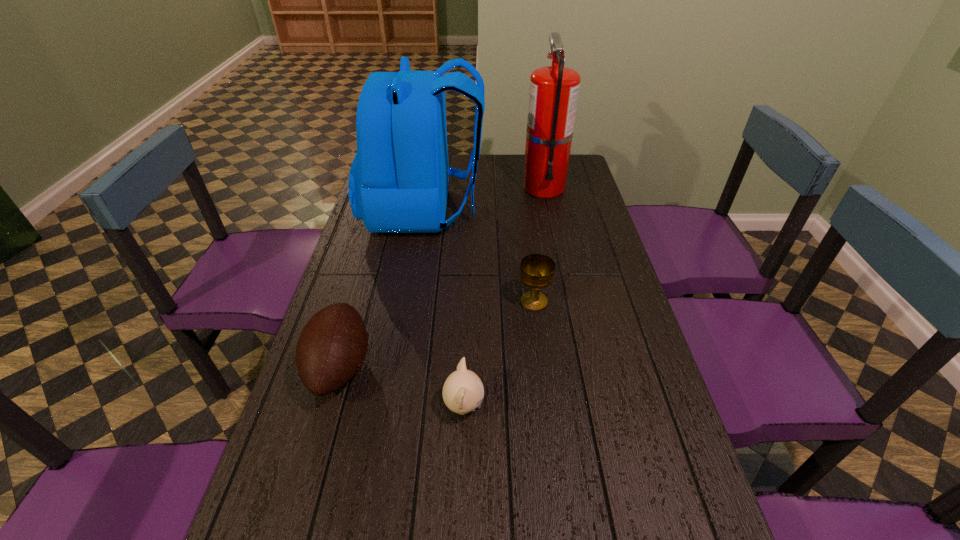
Identify the location of fire extinguisher that is at the far edge. (553, 96).

This screenshot has width=960, height=540. Find the location of `backpack that is at the far edge`. backpack that is at the far edge is located at coordinates (398, 182).

Identify the location of backpack that is at the left edge. (398, 182).

I want to click on football positioned at the left edge, so click(332, 347).

Where is `object present at the right edge`? The width and height of the screenshot is (960, 540). object present at the right edge is located at coordinates (553, 96).

Where is `object that is positioned at the far left corner`? The height and width of the screenshot is (540, 960). object that is positioned at the far left corner is located at coordinates (398, 182).

Locate an element on the screen. This screenshot has height=540, width=960. object situated at the far right corner is located at coordinates (553, 96).

At what (x,y) coordinates should I click in order to perform the action: click on blank space at the far edge. Please return your answer as a coordinate pair (x, y). The image size is (960, 540). Looking at the image, I should click on (492, 182).

In the image, there is a desktop. At what (x,y) coordinates should I click in order to perform the action: click on free space at the left edge. Please return your answer as a coordinate pair (x, y). The image size is (960, 540). Looking at the image, I should click on (345, 444).

Where is `vacant space at the right edge of the desktop`? The height and width of the screenshot is (540, 960). vacant space at the right edge of the desktop is located at coordinates (647, 453).